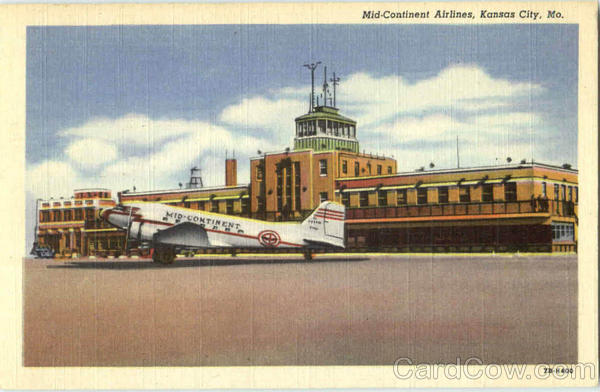
I want to click on windows, so click(x=506, y=196), click(x=488, y=198), click(x=463, y=200), click(x=403, y=201), click(x=381, y=201), click(x=287, y=194), click(x=241, y=201), click(x=228, y=207), click(x=216, y=208).